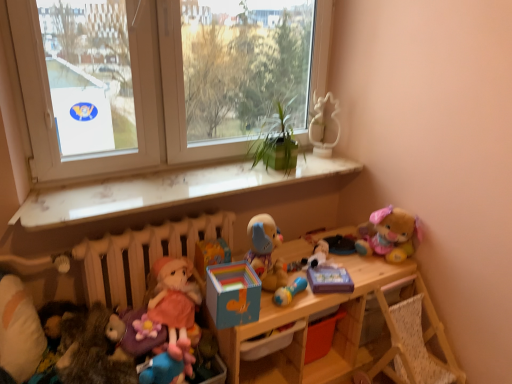
Question: Is transparent glass window at center, which is the 1th window screen from right to left, surrounding white paper at upper left, which is the 1th window screen in left-to-right order?

Choices:
 (A) yes
 (B) no

Answer: (B)

Question: From the image's perspective, would you say transparent glass window at center, which is the 1th window screen from right to left, is shown under white paper at upper left, positioned as the 2th window screen in right-to-left order?

Choices:
 (A) yes
 (B) no

Answer: (B)

Question: Is transparent glass window at center, which ranks as the second window screen in left-to-right order, outside white paper at upper left, positioned as the 2th window screen in right-to-left order?

Choices:
 (A) yes
 (B) no

Answer: (A)

Question: Considering the relative sizes of transparent glass window at center, which ranks as the second window screen in left-to-right order, and white paper at upper left, which is the 1th window screen in left-to-right order, in the image provided, is transparent glass window at center, which ranks as the second window screen in left-to-right order, smaller than white paper at upper left, which is the 1th window screen in left-to-right order,?

Choices:
 (A) no
 (B) yes

Answer: (A)

Question: Are transparent glass window at center, which ranks as the second window screen in left-to-right order, and white paper at upper left, which is the 1th window screen in left-to-right order, located far from each other?

Choices:
 (A) yes
 (B) no

Answer: (A)

Question: Is transparent glass window at center, which ranks as the second window screen in left-to-right order, facing away from white paper at upper left, which is the 1th window screen in left-to-right order?

Choices:
 (A) yes
 (B) no

Answer: (B)

Question: Is transparent glass window at center, which is the 1th window screen from right to left, outside white marble window sill at upper center?

Choices:
 (A) no
 (B) yes

Answer: (B)

Question: Does transparent glass window at center, which is the 1th window screen from right to left, appear on the right side of white marble window sill at upper center?

Choices:
 (A) yes
 (B) no

Answer: (A)

Question: Considering the relative sizes of transparent glass window at center, which ranks as the second window screen in left-to-right order, and white marble window sill at upper center in the image provided, is transparent glass window at center, which ranks as the second window screen in left-to-right order, thinner than white marble window sill at upper center?

Choices:
 (A) yes
 (B) no

Answer: (A)

Question: Could you tell me if transparent glass window at center, which is the 1th window screen from right to left, is turned towards white marble window sill at upper center?

Choices:
 (A) yes
 (B) no

Answer: (A)

Question: Considering the relative sizes of transparent glass window at center, which ranks as the second window screen in left-to-right order, and white marble window sill at upper center in the image provided, is transparent glass window at center, which ranks as the second window screen in left-to-right order, taller than white marble window sill at upper center?

Choices:
 (A) yes
 (B) no

Answer: (A)

Question: Does transparent glass window at center, which is the 1th window screen from right to left, touch white marble window sill at upper center?

Choices:
 (A) yes
 (B) no

Answer: (B)

Question: Is fluffy plush bear at upper right, placed as the 7th toy when sorted from left to right, not inside transparent glass window at center, which ranks as the second window screen in left-to-right order?

Choices:
 (A) yes
 (B) no

Answer: (A)